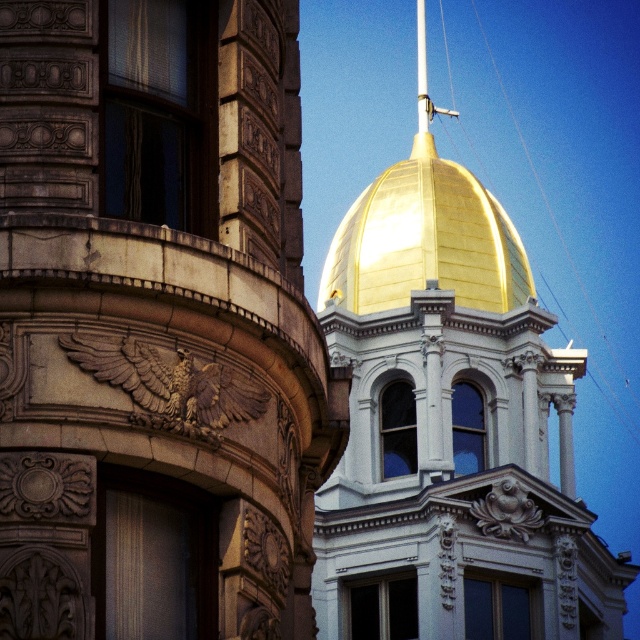
Who is shorter, gold polished dome at upper center or metallic pole at center?

gold polished dome at upper center

You are a GUI agent. You are given a task and a screenshot of the screen. Output one action in this format:
    pyautogui.click(x=<x>, y=<y>)
    Task: Click on the gold polished dome at upper center
    The height and width of the screenshot is (640, 640).
    Given the screenshot: What is the action you would take?
    pyautogui.click(x=426, y=241)

Does point (452, 243) lie in front of point (417, 10)?

Yes, it is in front of point (417, 10).

The height and width of the screenshot is (640, 640). I want to click on gold polished dome at upper center, so click(426, 241).